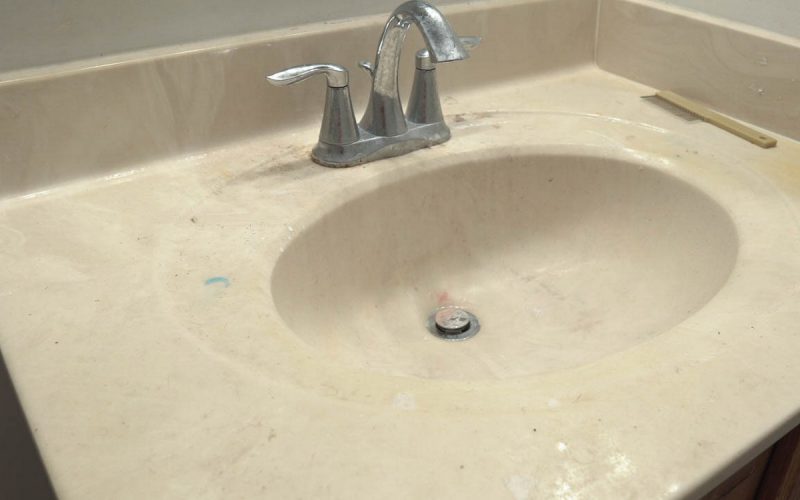
The image size is (800, 500). In order to click on corner in this screenshot , I will do `click(596, 37)`.